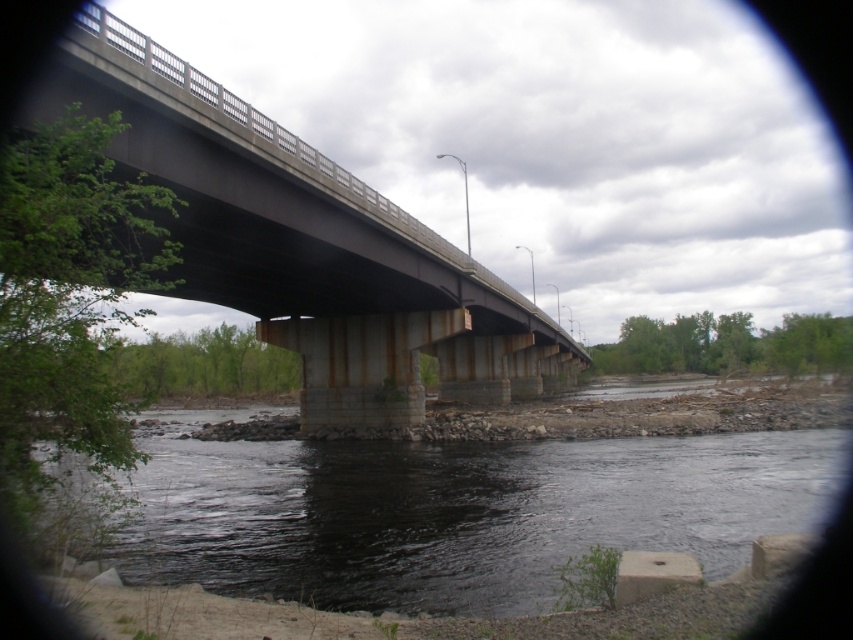
Can you confirm if black water at lower center is bigger than concrete bridge at center?

Actually, black water at lower center might be smaller than concrete bridge at center.

Can you confirm if black water at lower center is positioned to the left of concrete bridge at center?

Indeed, black water at lower center is positioned on the left side of concrete bridge at center.

The width and height of the screenshot is (853, 640). I want to click on black water at lower center, so click(x=461, y=513).

Where is `black water at lower center`? Image resolution: width=853 pixels, height=640 pixels. black water at lower center is located at coordinates (461, 513).